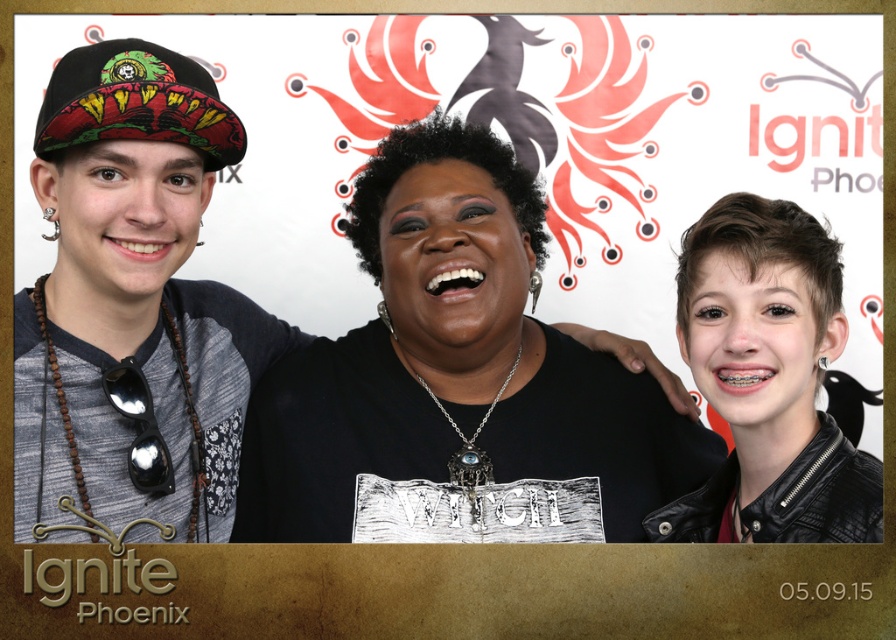
You are a photographer setting up a tripod to take a group photo. The denim jacket at left and the black leather jacket at right are part of the scene. If your tripod has a maximum reach of 3 feet, can you adjust the camera angle so that both jackets are in frame without moving the tripod?

The distance between the denim jacket at left and the black leather jacket at right is 3.36 feet. Since the tripod has a maximum reach of 3 feet, it cannot cover the entire distance between them. Therefore, you would need to either move closer to the jackets or adjust the tripod to ensure both are within the camera frame.

You are standing in front of the group photo. The denim jacket at left is represented by point (x=132, y=307). Where is the denim jacket at left located in the photo?

The denim jacket at left is located at point (x=132, y=307) in the photo.

Looking at this image, you are a photographer trying to decide which jacket to feature in a closeup shot. The scene has a denim jacket at left and a black leather jacket at right. Which jacket should you zoom in on if you want to capture the one that takes up more space in the frame?

The denim jacket at left has a larger width than the black leather jacket at right, so you should zoom in on the denim jacket at left to capture the one that takes up more space in the frame.